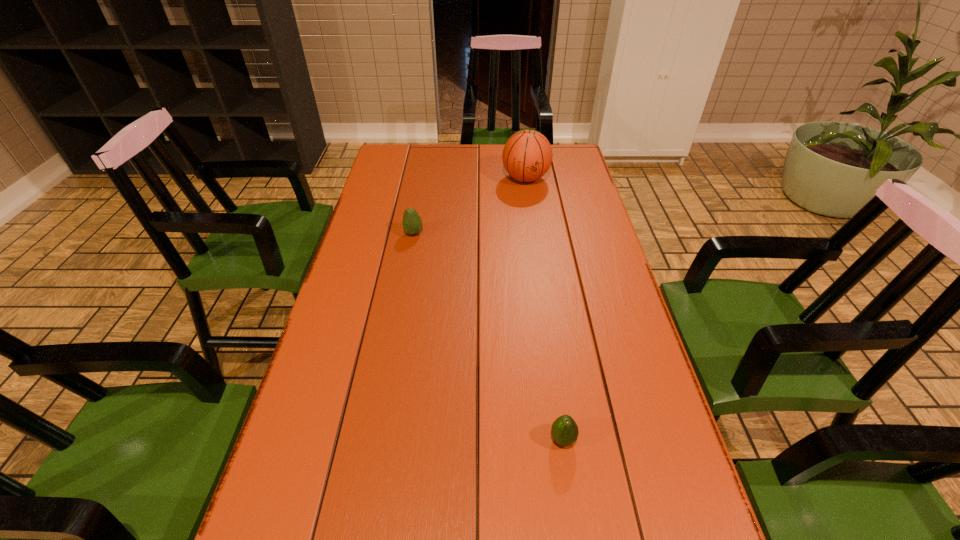
The width and height of the screenshot is (960, 540). I want to click on object positioned at the left edge, so click(412, 224).

Identify the location of object at the right edge. (527, 155).

What are the coordinates of `object situated at the far right corner` in the screenshot? It's located at (527, 155).

In the image, there is a desktop. Identify the location of blank space at the far edge. (447, 156).

You are a GUI agent. You are given a task and a screenshot of the screen. Output one action in this format:
    pyautogui.click(x=<x>, y=<y>)
    Task: Click on the blank space at the left edge
    Image resolution: width=960 pixels, height=540 pixels.
    Given the screenshot: What is the action you would take?
    pyautogui.click(x=268, y=514)

Locate an element on the screen. The width and height of the screenshot is (960, 540). free space at the right edge is located at coordinates (637, 403).

Where is `vacant position at the far left corner of the desktop`? This screenshot has width=960, height=540. vacant position at the far left corner of the desktop is located at coordinates (412, 161).

In the image, there is a desktop. Where is `vacant space at the far right corner`? Image resolution: width=960 pixels, height=540 pixels. vacant space at the far right corner is located at coordinates (573, 173).

Image resolution: width=960 pixels, height=540 pixels. Find the location of `vacant space in between the leftmost object and the shortest object`. vacant space in between the leftmost object and the shortest object is located at coordinates (489, 336).

Image resolution: width=960 pixels, height=540 pixels. Identify the location of empty space that is in between the nearer avocado and the left avocado. (489, 336).